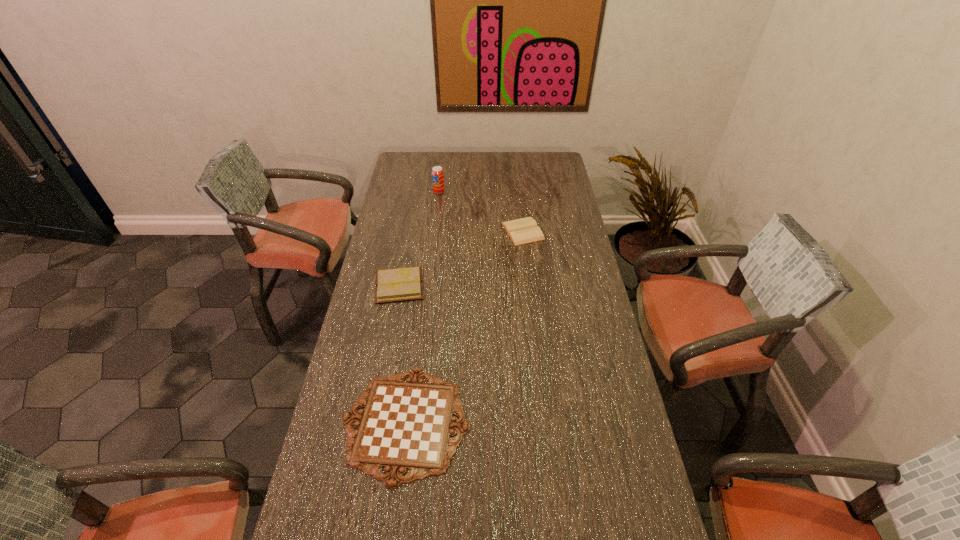
Image resolution: width=960 pixels, height=540 pixels. What are the coordinates of `free space located on the right of the third farthest object` in the screenshot? It's located at (452, 285).

You are a GUI agent. You are given a task and a screenshot of the screen. Output one action in this format:
    pyautogui.click(x=<x>, y=<y>)
    Task: Click on the vacant space located 0.150m on the right of the chessboard
    The height and width of the screenshot is (540, 960).
    Given the screenshot: What is the action you would take?
    pyautogui.click(x=523, y=423)

The image size is (960, 540). I want to click on diary located at the left edge, so click(x=400, y=284).

Locate an element on the screen. The width and height of the screenshot is (960, 540). chessboard located at the left edge is located at coordinates (405, 425).

Where is `object that is at the right edge`? object that is at the right edge is located at coordinates (521, 231).

Where is `vacant space at the left edge of the desktop`? vacant space at the left edge of the desktop is located at coordinates coord(358,429).

In the image, there is a desktop. At what (x,y) coordinates should I click in order to perform the action: click on vacant area at the right edge. Please return your answer as a coordinate pair (x, y). The height and width of the screenshot is (540, 960). Looking at the image, I should click on (543, 227).

This screenshot has width=960, height=540. Find the location of `vacant space at the far left corner`. vacant space at the far left corner is located at coordinates (402, 163).

This screenshot has height=540, width=960. In the image, there is a desktop. Identify the location of vacant space at the far right corner. (540, 171).

This screenshot has width=960, height=540. Identify the location of free space between the third nearest object and the soda can. (481, 211).